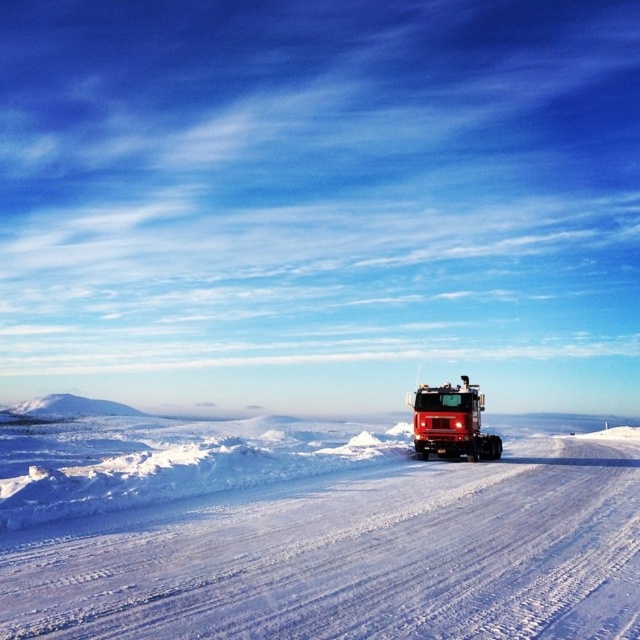
Question: From the image, what is the correct spatial relationship of white powdery snow at center in relation to red matte fire truck at center?

Choices:
 (A) above
 (B) below

Answer: (B)

Question: Does white powdery snow at center appear under red matte fire truck at center?

Choices:
 (A) yes
 (B) no

Answer: (A)

Question: Which point is closer to the camera?

Choices:
 (A) (170, 600)
 (B) (460, 412)

Answer: (A)

Question: Which of the following is the farthest from the observer?

Choices:
 (A) red matte fire truck at center
 (B) white powdery snow at center

Answer: (A)

Question: Does white powdery snow at center come in front of red matte fire truck at center?

Choices:
 (A) no
 (B) yes

Answer: (B)

Question: Among these objects, which one is farthest from the camera?

Choices:
 (A) white powdery snow at center
 (B) red matte fire truck at center

Answer: (B)